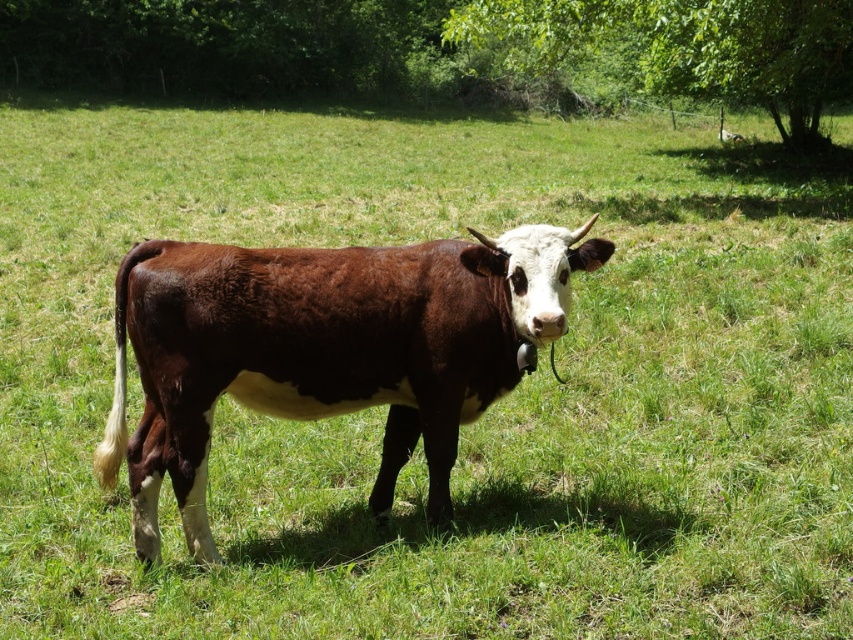
Question: Which point is farther from the camera taking this photo?

Choices:
 (A) (196, 488)
 (B) (827, 92)

Answer: (B)

Question: Is brown smooth cow at center positioned at the back of green leafy tree at upper right?

Choices:
 (A) no
 (B) yes

Answer: (A)

Question: Is brown smooth cow at center above green leafy tree at upper right?

Choices:
 (A) no
 (B) yes

Answer: (A)

Question: Can you confirm if brown smooth cow at center is positioned to the right of green leafy tree at upper right?

Choices:
 (A) yes
 (B) no

Answer: (B)